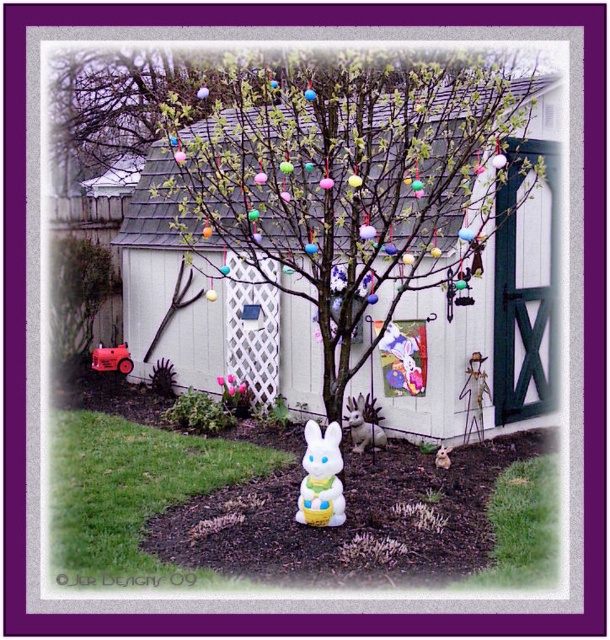
You are setting up an Easter display and have two bunnies, the white glossy plastic bunny at center and the white plastic bunny at center. Which bunny is shorter?

The white glossy plastic bunny at center is shorter than the white plastic bunny at center.

You are planning to place a new Easter decoration between the white wood at center and the white glossy plastic bunny at center. Which object should you place the decoration closer to if you want it to be closer to the taller object?

You should place the decoration closer to the white wood at center because it is taller than the white glossy plastic bunny at center.